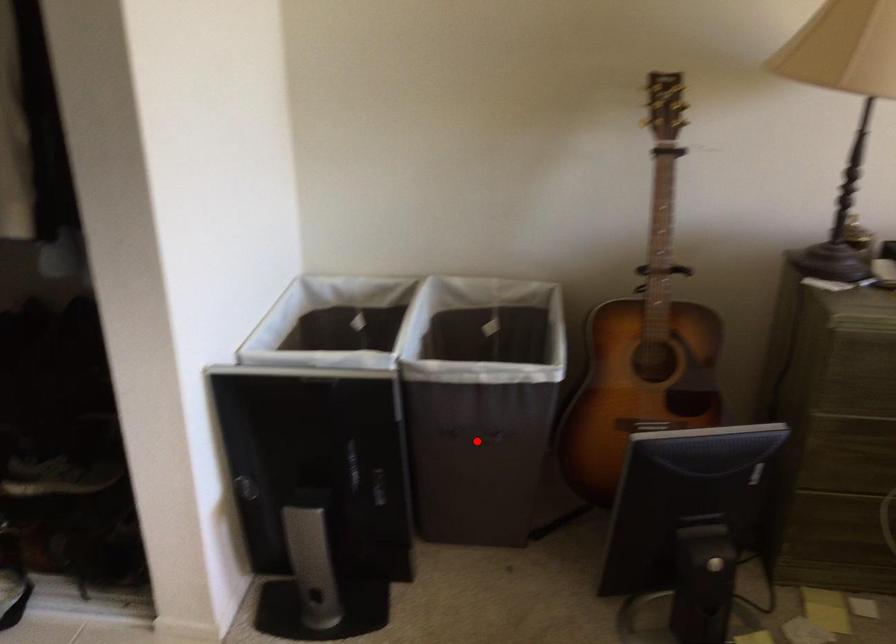
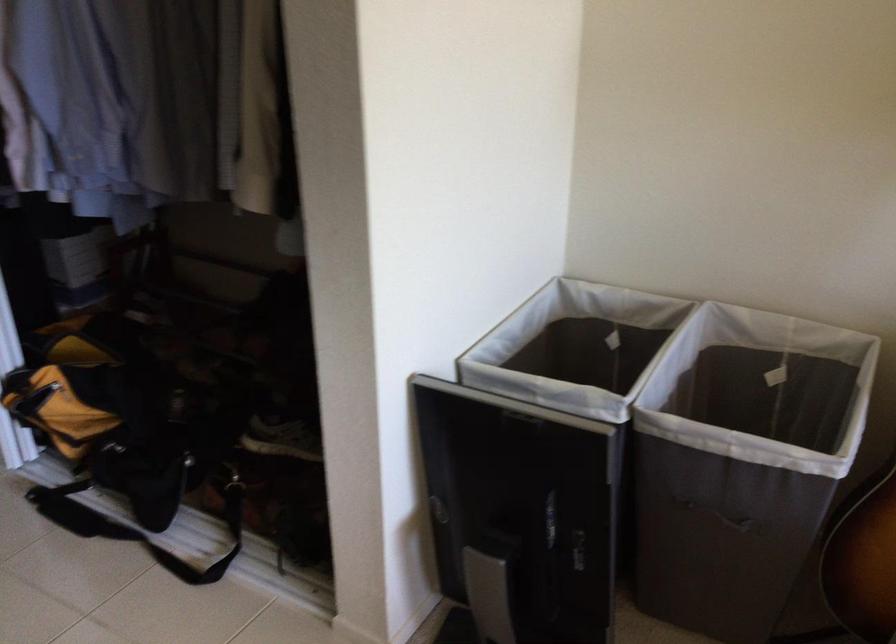
Question: I am providing you with two images of the same scene from different viewpoints. Image1 has a red point marked. In image2, the corresponding 3D location appears at what relative position? Reply with the corresponding letter.

Choices:
 (A) Closer
 (B) Farther

Answer: (A)